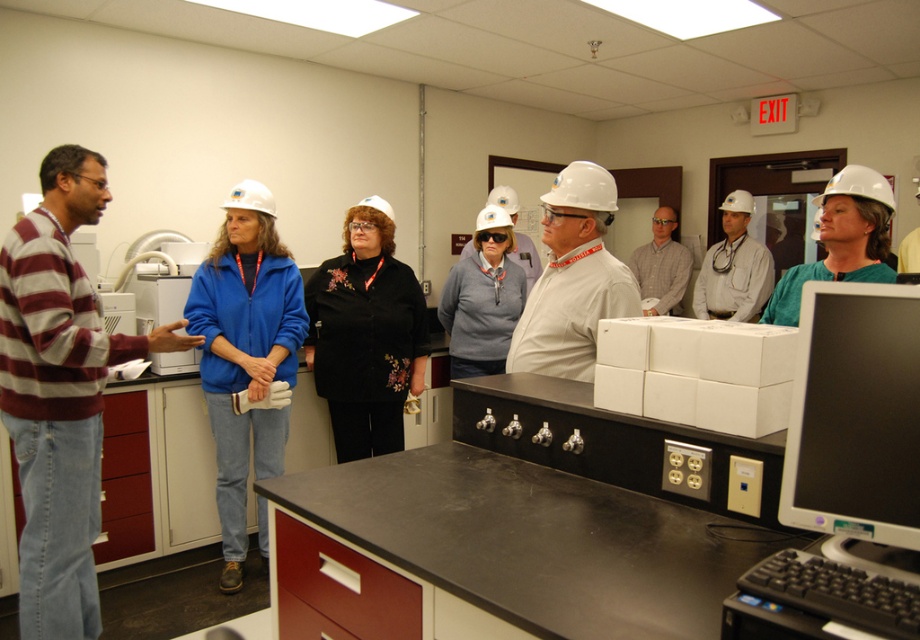
You are organizing a charity event and need to determine which of the two items, the striped sweater at left or the black velvet jacket at center, can accommodate a larger donation box. Based on the scene, which item is bigger?

The striped sweater at left has a larger size compared to the black velvet jacket at center, so the striped sweater at left can accommodate a larger donation box.

You are a safety inspector in the lab and need to check the height of the black velvet jacket at center and the green matte hard hat at upper right. Which object is taller?

The black velvet jacket at center is taller than the green matte hard hat at upper right according to the description.

You are a maintenance worker who needs to reach the blue fabric jacket at center located 2.81 meters away. Your current tool can only extend 2 meters. Can you safely retrieve it with your current tool?

The blue fabric jacket at center is 2.81 meters away from the camera, which is beyond the 2 meters reach of your tool. Therefore, you cannot safely retrieve it with your current tool.